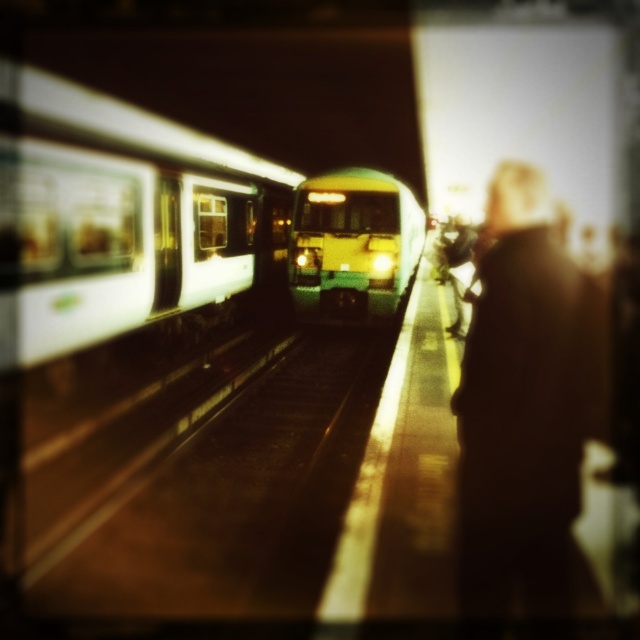
Looking at this image, you are standing at the center of the subway station platform and want to find the dark brown coat at right. According to the coordinates provided, in which direction should you move to locate it?

The dark brown coat at right is located at coordinates point (525, 412). Since you are at the center, moving towards the right side of the platform would help you locate it.

You are waiting on the subway platform and see the white glossy train at left and the green matte train at center. Which train is closer to the edge marked by the bright yellow line?

The white glossy train at left is closer to the edge marked by the bright yellow line because it is positioned to the left of the green matte train at center, and the yellow line is on the left side of the platform.

You are a subway engineer designing a new platform. The platform needs to accommodate both the white glossy train at left and the green matte train at center. Given their widths, which train requires a wider platform section?

The green matte train at center requires a wider platform section because its width is greater than the white glossy train at left.